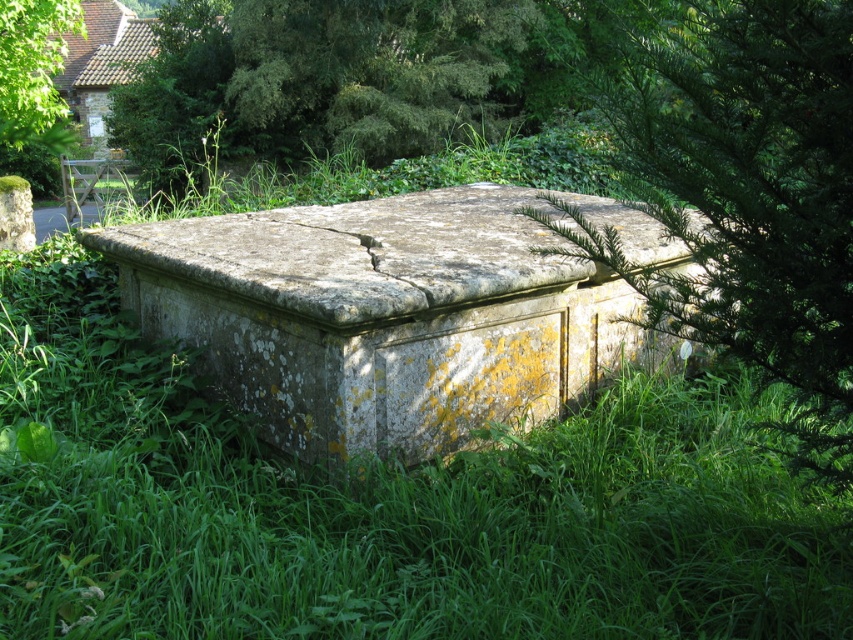
Can you confirm if green leafy tree at center is bigger than green leafy tree at upper center?

Incorrect, green leafy tree at center is not larger than green leafy tree at upper center.

Is green leafy tree at center thinner than green leafy tree at upper center?

Correct, green leafy tree at center's width is less than green leafy tree at upper center's.

Who is more distant from viewer, (773, 248) or (477, 58)?

The point (477, 58) is more distant.

Where is `green leafy tree at center`? This screenshot has height=640, width=853. green leafy tree at center is located at coordinates (747, 196).

Based on the photo, can you confirm if green leafy tree at upper center is shorter than green leafy tree at upper left?

Correct, green leafy tree at upper center is not as tall as green leafy tree at upper left.

Who is positioned more to the left, green leafy tree at upper center or green leafy tree at upper left?

green leafy tree at upper left

What do you see at coordinates (372, 72) in the screenshot? I see `green leafy tree at upper center` at bounding box center [372, 72].

Identify the location of green leafy tree at upper center. Image resolution: width=853 pixels, height=640 pixels. (372, 72).

From the picture: Does speckled stone sarcophagus at center appear on the right side of green leafy tree at upper center?

Indeed, speckled stone sarcophagus at center is positioned on the right side of green leafy tree at upper center.

Does speckled stone sarcophagus at center appear under green leafy tree at upper center?

Yes, speckled stone sarcophagus at center is below green leafy tree at upper center.

Which is behind, point (506, 273) or point (439, 96)?

Point (439, 96)

Where is `speckled stone sarcophagus at center`? This screenshot has height=640, width=853. speckled stone sarcophagus at center is located at coordinates tap(395, 314).